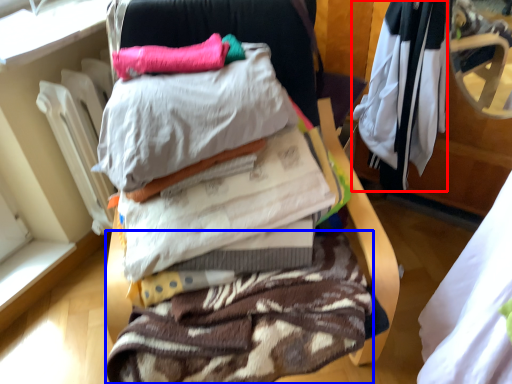
Question: Among these objects, which one is farthest to the camera, clothing (highlighted by a red box) or clothing (highlighted by a blue box)?

Choices:
 (A) clothing
 (B) clothing

Answer: (A)